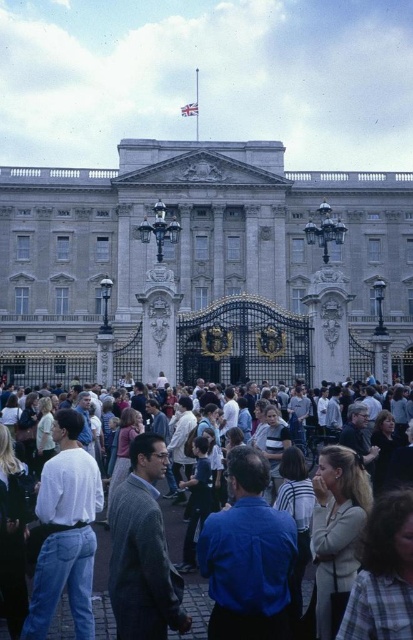
You are a photographer trying to capture a photo of the Buckingham Palace crowd. You notice the white cotton shirt at center and the plaid shirt at lower right. Which shirt should you focus on to ensure it fits entirely within your camera frame if your current frame can only accommodate the width of the narrower shirt?

The plaid shirt at lower right is narrower than the white cotton shirt at center, so focusing on the plaid shirt at lower right ensures it fits within the frame.

You are standing in front of Buckingham Palace and want to take a photo. You notice two points marked in the scene. The first point is at coordinates point [408,186] and the second is at point [140,509]. Which point is closer to you?

Point [408,186] is further to the viewer than point [140,509], so the second point is closer to you.

You are a photographer standing at the Buckingham Palace, and you want to capture a photo of both the white cotton shirt at center and the plaid shirt at lower right in the same frame. Given that your camera has a 50mm lens with a field of view of 46 degrees, can you fit both subjects into the frame without moving closer or farther away?

The distance between the white cotton shirt at center and the plaid shirt at lower right is 11.41 meters. With a 50mm lens providing a 46 degree field of view, the maximum horizontal coverage at your current distance would need to be calculated. However, without knowing the exact distance from the camera to the subjects, it is impossible to definitively determine if both can fit. Additional information about the shooting distance is required for an accurate assessment.